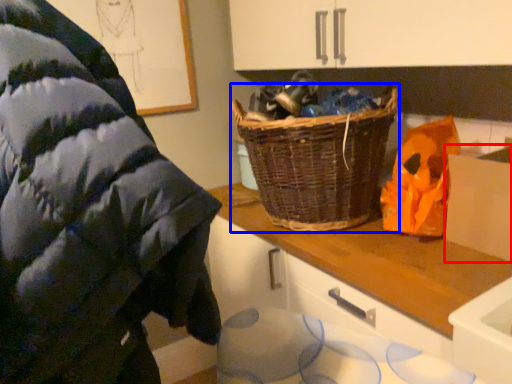
Question: Among these objects, which one is nearest to the camera, cardboard box (highlighted by a red box) or picnic basket (highlighted by a blue box)?

Choices:
 (A) cardboard box
 (B) picnic basket

Answer: (A)